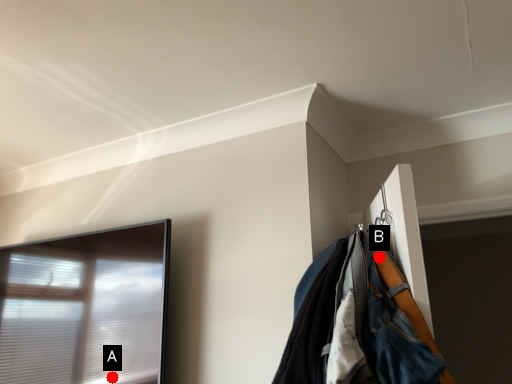
Question: Two points are circled on the image, labeled by A and B beside each circle. Which point is closer to the camera?

Choices:
 (A) A is closer
 (B) B is closer

Answer: (B)